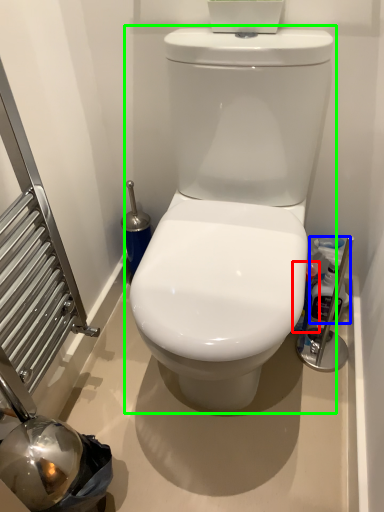
Question: Which object is positioned farthest from cleaning product (highlighted by a red box)? Select from cleaning product (highlighted by a blue box) and toilet (highlighted by a green box).

Choices:
 (A) cleaning product
 (B) toilet

Answer: (B)